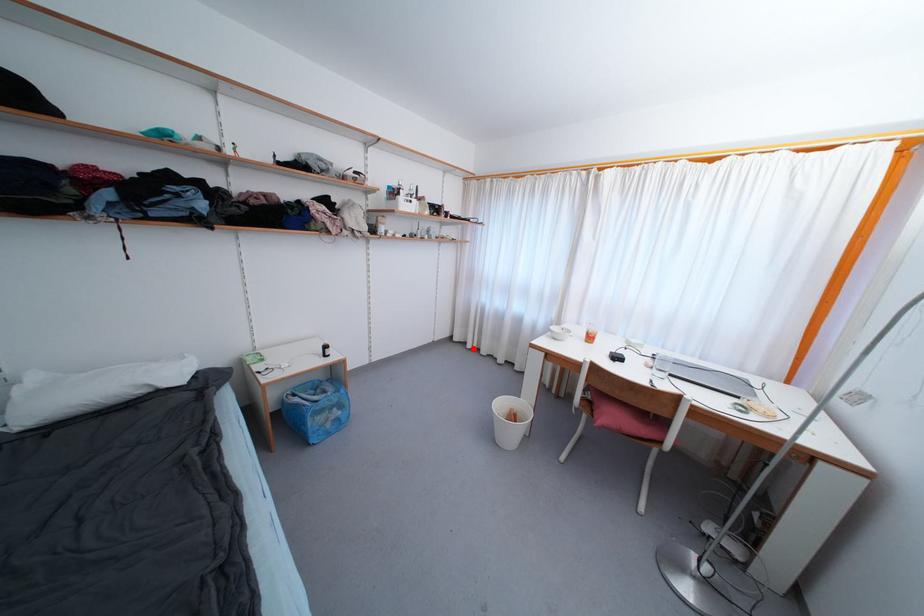
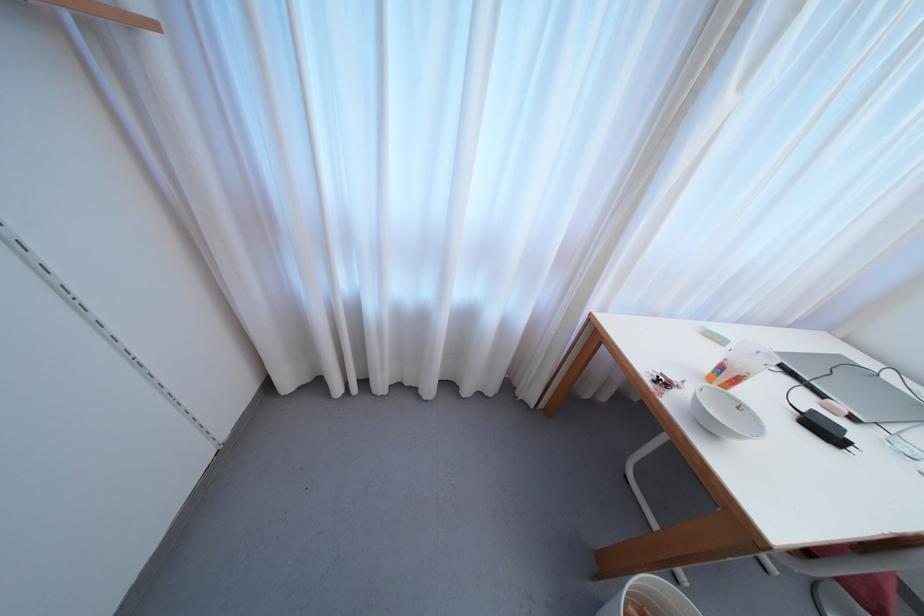
The point at the highlighted location is marked in the first image. Where is the corresponding point in the second image?

(342, 392)